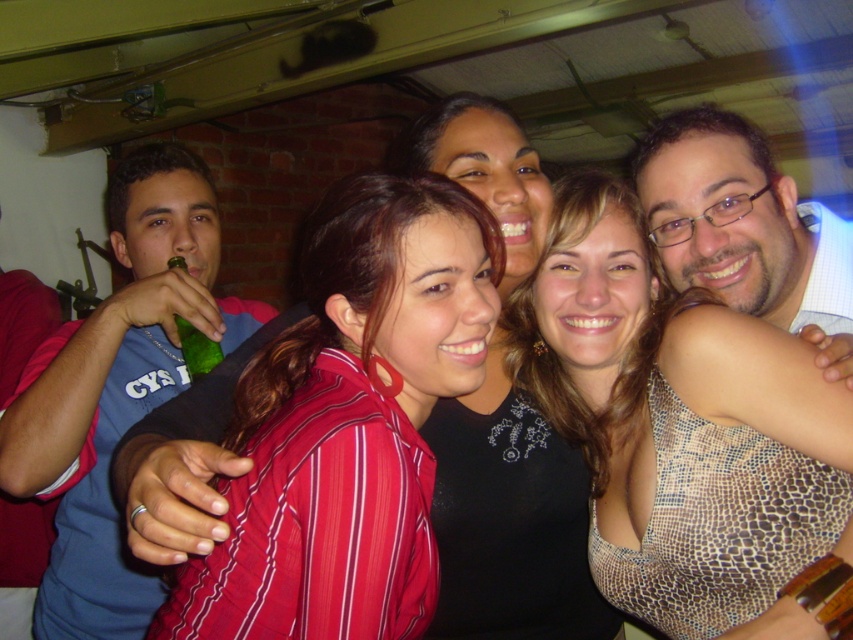
Question: Which object appears farthest from the camera in this image?

Choices:
 (A) green glass bottle at upper left
 (B) leopard print dress at center
 (C) red cotton shirt at left

Answer: (C)

Question: Can you confirm if red cotton shirt at left is thinner than green glass bottle at upper left?

Choices:
 (A) yes
 (B) no

Answer: (B)

Question: Is the position of striped fabric shirt at center more distant than that of red cotton shirt at left?

Choices:
 (A) yes
 (B) no

Answer: (B)

Question: Which point is closer to the camera?

Choices:
 (A) leopard print dress at center
 (B) green glass bottle at upper left
 (C) blue fabric shirt at left

Answer: (A)

Question: Which of the following is the farthest from the observer?

Choices:
 (A) (334, 596)
 (B) (28, 513)
 (C) (744, 556)
 (D) (212, 346)

Answer: (B)

Question: Is red cotton shirt at left bigger than green glass bottle at upper left?

Choices:
 (A) no
 (B) yes

Answer: (B)